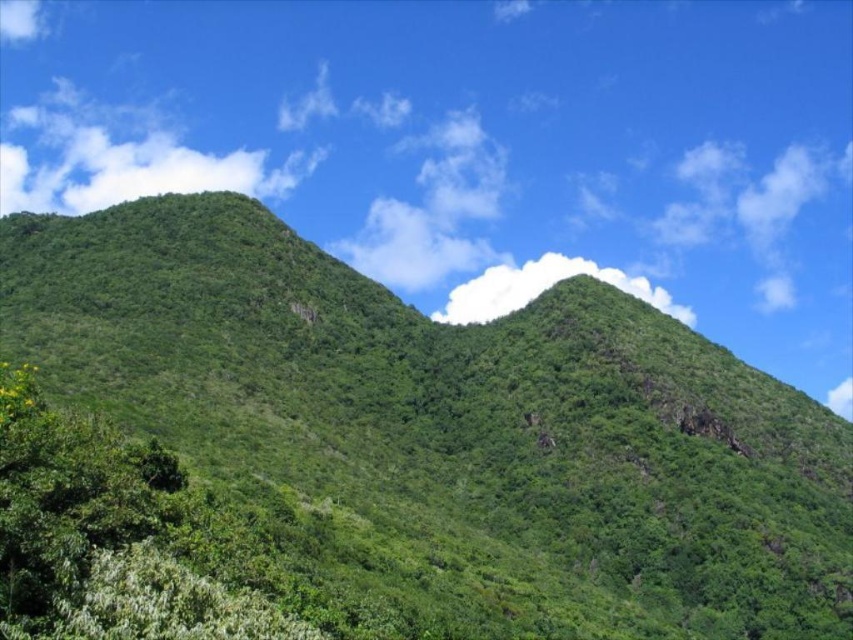
Question: Is white fluffy cloud at upper left smaller than white fluffy cloud at upper center?

Choices:
 (A) yes
 (B) no

Answer: (B)

Question: Which of the following is the farthest from the observer?

Choices:
 (A) (45, 586)
 (B) (39, 198)
 (C) (605, 520)

Answer: (B)

Question: Which point appears farthest from the camera in this image?

Choices:
 (A) (479, 291)
 (B) (397, 300)
 (C) (244, 179)

Answer: (C)

Question: Can you confirm if white fluffy cloud at upper left is bigger than white fluffy cloud at upper center?

Choices:
 (A) no
 (B) yes

Answer: (B)

Question: Which is nearer to the white fluffy cloud at upper center?

Choices:
 (A) green leafy tree at left
 (B) green leafy hillside at center
 (C) white fluffy cloud at upper left

Answer: (B)

Question: Is white fluffy cloud at upper left wider than white fluffy cloud at upper center?

Choices:
 (A) no
 (B) yes

Answer: (B)